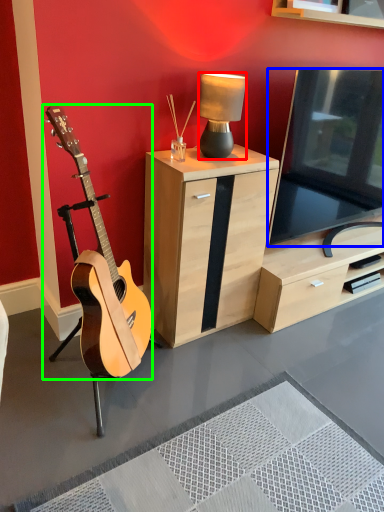
Question: Which object is positioned farthest from lamp (highlighted by a red box)? Select from television (highlighted by a blue box) and guitar (highlighted by a green box).

Choices:
 (A) television
 (B) guitar

Answer: (B)